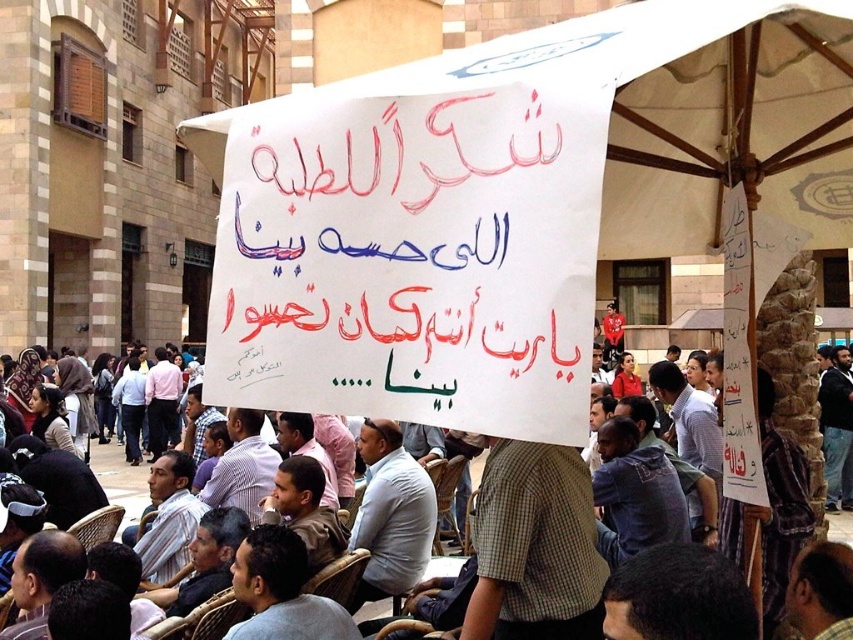
Question: Is wooden textured chair at center smaller than brown woven chair at lower center?

Choices:
 (A) no
 (B) yes

Answer: (A)

Question: Does wooden textured chair at center have a greater width compared to brown woven chair at lower center?

Choices:
 (A) no
 (B) yes

Answer: (B)

Question: Is white paper sign at center to the right of wooden textured chair at center from the viewer's perspective?

Choices:
 (A) no
 (B) yes

Answer: (A)

Question: Estimate the real-world distances between objects in this image. Which object is closer to the wooden textured chair at center?

Choices:
 (A) white paper sign at center
 (B) brown woven chair at lower center

Answer: (A)

Question: Considering the real-world distances, which object is closest to the wooden textured chair at center?

Choices:
 (A) brown woven chair at lower center
 (B) white paper sign at center

Answer: (B)

Question: Which of these objects is positioned closest to the wooden textured chair at center?

Choices:
 (A) white paper sign at center
 (B) brown woven chair at lower center

Answer: (A)